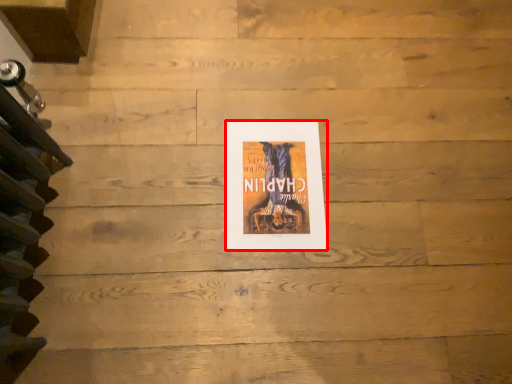
Question: Considering the relative positions of poster (annotated by the red box) and stairwell in the image provided, where is poster (annotated by the red box) located with respect to the staircase?

Choices:
 (A) right
 (B) left

Answer: (A)